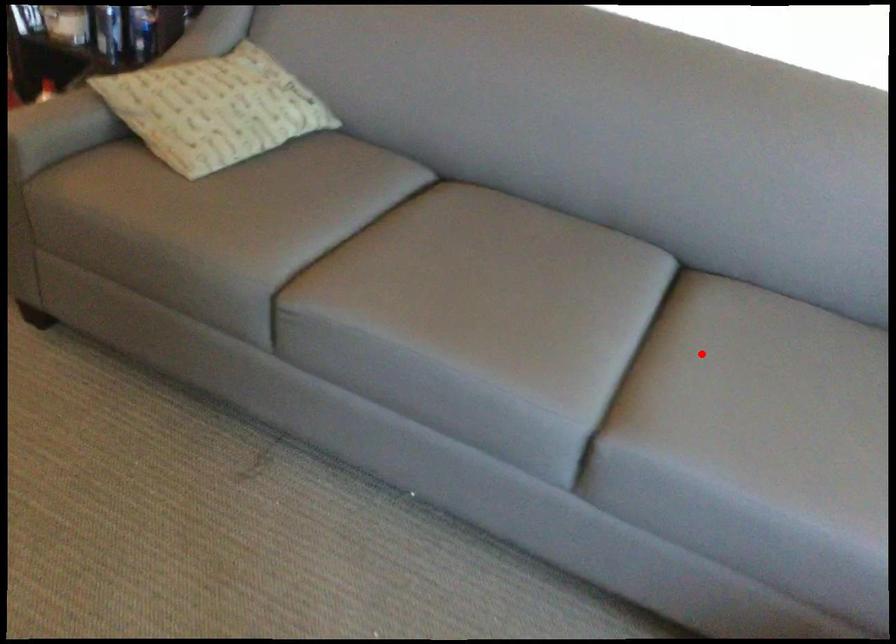
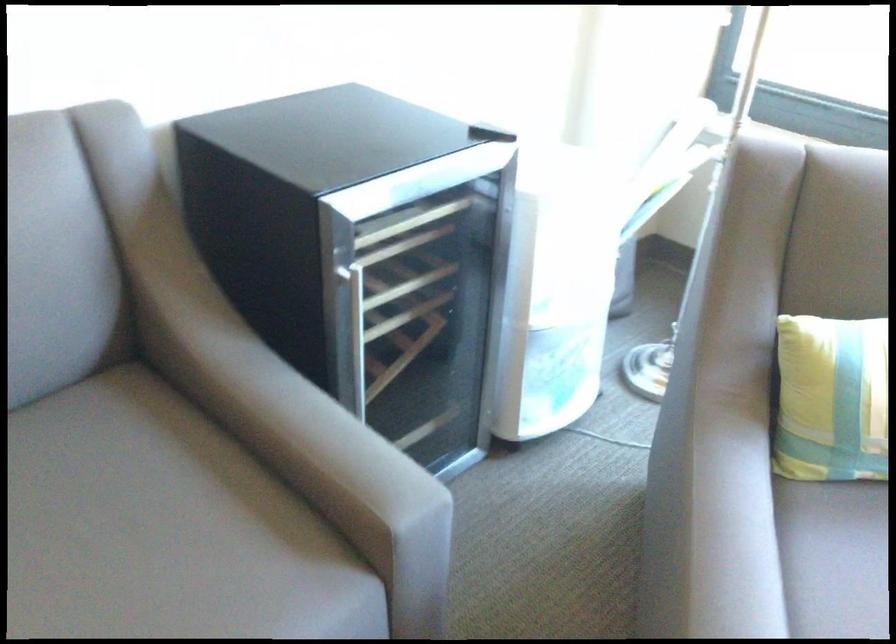
Question: A red point is marked in image1. In image2, is the corresponding 3D point closer to the camera or farther? Reply with the corresponding letter.

Choices:
 (A) The corresponding 3D point is closer.
 (B) The corresponding 3D point is farther.

Answer: (A)